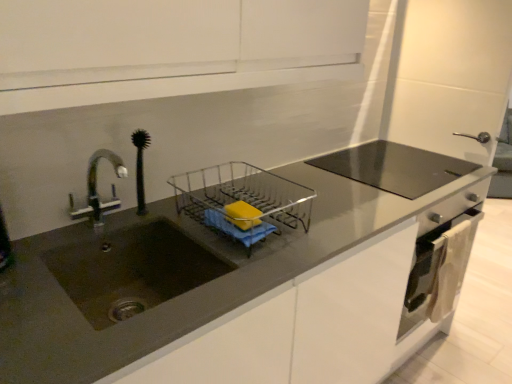
Locate an element on the screen. Image resolution: width=512 pixels, height=384 pixels. spots to the right of yellow matte soap at center is located at coordinates (297, 234).